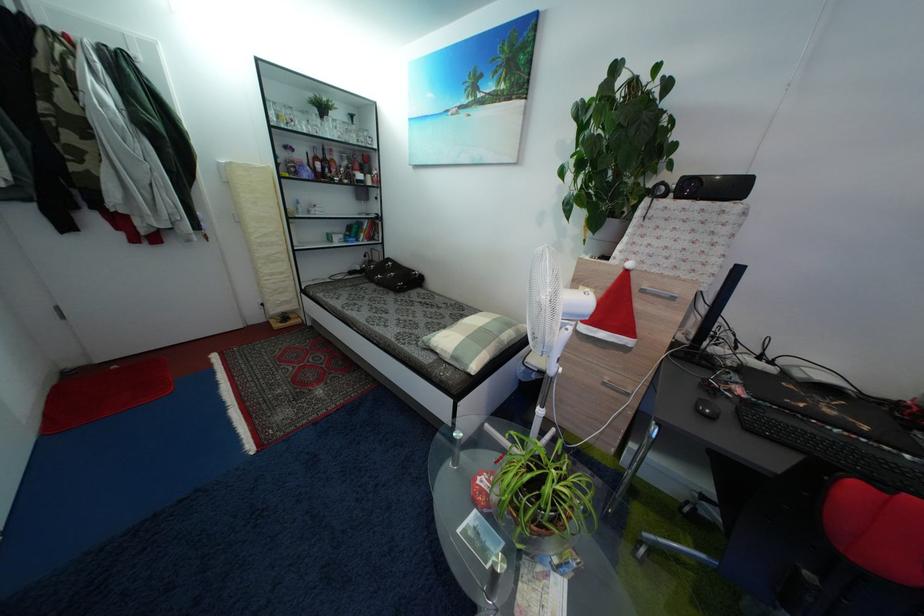
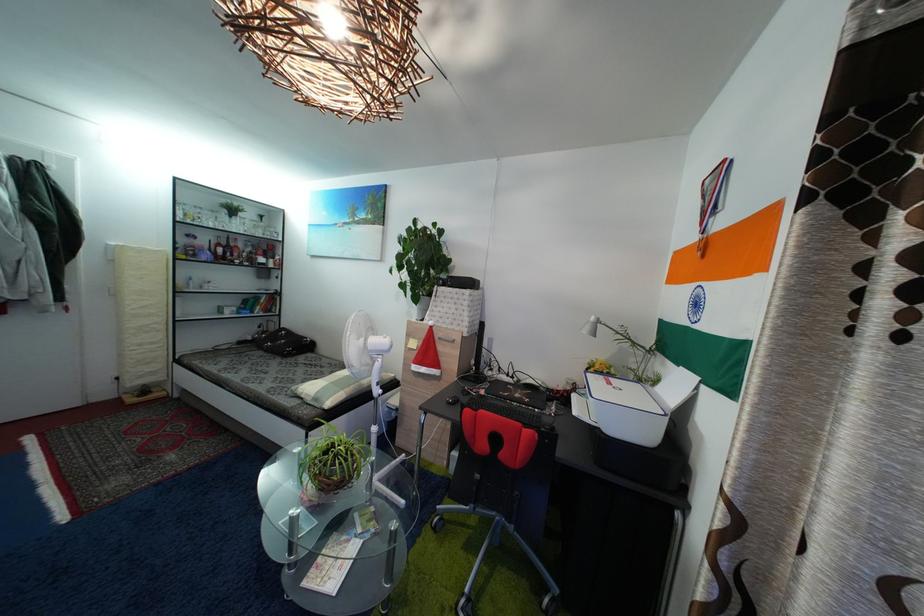
Where in the second image is the point corresponding to pixel 456 365 from the first image?

(318, 407)